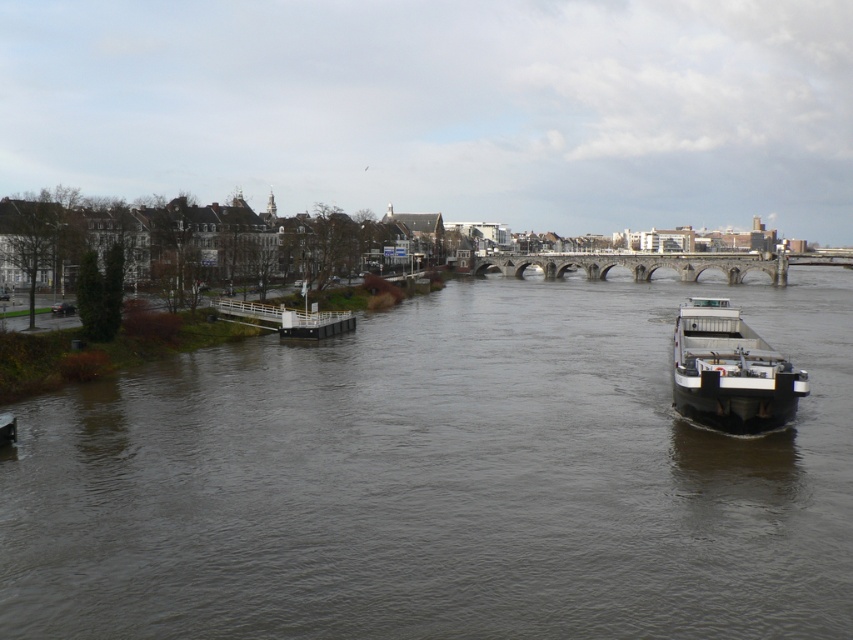
Question: Considering the real-world distances, which object is farthest from the dark gray water at center?

Choices:
 (A) white matte barge at right
 (B) stone arch bridge at center

Answer: (B)

Question: Observing the image, what is the correct spatial positioning of dark gray water at center in reference to white matte barge at right?

Choices:
 (A) left
 (B) right

Answer: (A)

Question: Can you confirm if dark gray water at center is bigger than white matte barge at right?

Choices:
 (A) yes
 (B) no

Answer: (A)

Question: Which point appears farthest from the camera in this image?

Choices:
 (A) (538, 259)
 (B) (720, 412)

Answer: (A)

Question: Does white matte barge at right have a smaller size compared to stone arch bridge at center?

Choices:
 (A) no
 (B) yes

Answer: (B)

Question: Estimate the real-world distances between objects in this image. Which object is farther from the dark gray water at center?

Choices:
 (A) stone arch bridge at center
 (B) white matte barge at right

Answer: (A)